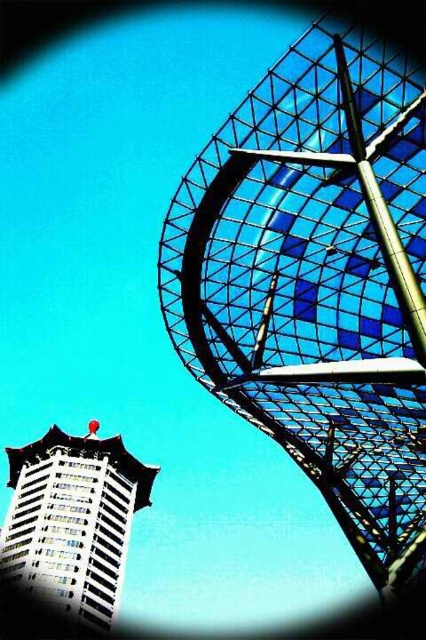
Question: Is transparent glass tower at upper right positioned in front of white glossy building at lower left?

Choices:
 (A) yes
 (B) no

Answer: (A)

Question: From the image, what is the correct spatial relationship of transparent glass tower at upper right in relation to white glossy building at lower left?

Choices:
 (A) right
 (B) left

Answer: (A)

Question: Does transparent glass tower at upper right have a lesser width compared to white glossy building at lower left?

Choices:
 (A) no
 (B) yes

Answer: (B)

Question: Among these objects, which one is nearest to the camera?

Choices:
 (A) transparent glass tower at upper right
 (B) white glossy building at lower left

Answer: (A)